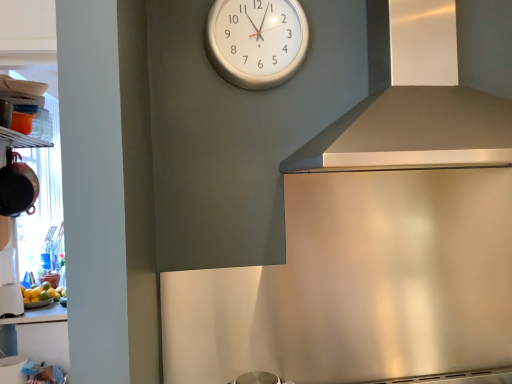
The height and width of the screenshot is (384, 512). I want to click on white glossy clock at upper center, so click(x=256, y=41).

You are a GUI agent. You are given a task and a screenshot of the screen. Output one action in this format:
    pyautogui.click(x=<x>, y=<y>)
    Task: Click on the yellow matte bowl at lower left
    The height and width of the screenshot is (384, 512).
    Given the screenshot: What is the action you would take?
    click(x=41, y=293)

Where is `satin silver exhaust hood at upper right`? satin silver exhaust hood at upper right is located at coordinates (429, 95).

Where is `white glossy cup at lower left, which ranks as the 2th appliance in top-to-bottom order`? This screenshot has height=384, width=512. white glossy cup at lower left, which ranks as the 2th appliance in top-to-bottom order is located at coordinates (11, 300).

Find the location of `white glossy clock at upper center`. white glossy clock at upper center is located at coordinates (256, 41).

Is white glossy cup at lower left, which is counted as the first appliance, starting from the bottom, inside or outside of yellow matte bowl at lower left?

white glossy cup at lower left, which is counted as the first appliance, starting from the bottom, is spatially situated outside yellow matte bowl at lower left.

Is yellow matte bowl at lower left at the back of white glossy cup at lower left, which is counted as the first appliance, starting from the bottom?

white glossy cup at lower left, which is counted as the first appliance, starting from the bottom, does not have its back to yellow matte bowl at lower left.

Is white glossy cup at lower left, which ranks as the 2th appliance in top-to-bottom order, behind yellow matte bowl at lower left?

No, white glossy cup at lower left, which ranks as the 2th appliance in top-to-bottom order, is closer to the camera.

Measure the distance between satin silver exhaust hood at upper right and white glossy cup at lower left, which is counted as the first appliance, starting from the bottom.

satin silver exhaust hood at upper right is 7.24 feet from white glossy cup at lower left, which is counted as the first appliance, starting from the bottom.

Does satin silver exhaust hood at upper right turn towards white glossy cup at lower left, which is counted as the first appliance, starting from the bottom?

No, satin silver exhaust hood at upper right is not turned towards white glossy cup at lower left, which is counted as the first appliance, starting from the bottom.

Find the location of a particular element. Image resolution: width=512 pixels, height=384 pixels. the 2nd appliance to the left when counting from the satin silver exhaust hood at upper right is located at coordinates (11, 300).

From the image's perspective, is satin silver exhaust hood at upper right beneath white glossy cup at lower left, which ranks as the 2th appliance in top-to-bottom order?

Actually, satin silver exhaust hood at upper right appears above white glossy cup at lower left, which ranks as the 2th appliance in top-to-bottom order, in the image.

From a real-world perspective, which object stands above the other?

white glossy cup at lower left, which is counted as the first appliance, starting from the bottom, is physically above.

Is yellow matte bowl at lower left behind white glossy cup at lower left, which ranks as the 2th appliance in top-to-bottom order?

Yes, the depth of yellow matte bowl at lower left is greater than that of white glossy cup at lower left, which ranks as the 2th appliance in top-to-bottom order.

Between yellow matte bowl at lower left and white glossy cup at lower left, which ranks as the 2th appliance in top-to-bottom order, which one appears on the left side from the viewer's perspective?

white glossy cup at lower left, which ranks as the 2th appliance in top-to-bottom order.

Which point is more forward, (36, 301) or (21, 302)?

Positioned in front is point (21, 302).

Which object is thinner, yellow matte bowl at lower left or matte black pot at left, the first appliance from the top?

With smaller width is matte black pot at left, the first appliance from the top.

Can you confirm if yellow matte bowl at lower left is smaller than matte black pot at left, the first appliance from the top?

Yes, yellow matte bowl at lower left is smaller than matte black pot at left, the first appliance from the top.

Looking at this image, is yellow matte bowl at lower left oriented away from matte black pot at left, the 2th appliance in the bottom-to-top sequence?

No.

Looking at this image, is yellow matte bowl at lower left beside matte black pot at left, the first appliance from the top?

No, yellow matte bowl at lower left is not with matte black pot at left, the first appliance from the top.

Does point (259, 28) come behind point (33, 297)?

That is False.

How different are the orientations of white glossy clock at upper center and yellow matte bowl at lower left in degrees?

The angle between the facing direction of white glossy clock at upper center and the facing direction of yellow matte bowl at lower left is 90.9 degrees.

Is white glossy clock at upper center next to yellow matte bowl at lower left?

No, white glossy clock at upper center is not beside yellow matte bowl at lower left.

Considering the sizes of objects white glossy clock at upper center and yellow matte bowl at lower left in the image provided, who is wider, white glossy clock at upper center or yellow matte bowl at lower left?

yellow matte bowl at lower left is wider.

From the image's perspective, is satin silver exhaust hood at upper right located beneath matte black pot at left, the 2th appliance in the bottom-to-top sequence?

Actually, satin silver exhaust hood at upper right appears above matte black pot at left, the 2th appliance in the bottom-to-top sequence, in the image.

Is satin silver exhaust hood at upper right oriented towards matte black pot at left, the 2th appliance in the bottom-to-top sequence?

No.

Between satin silver exhaust hood at upper right and matte black pot at left, the 2th appliance in the bottom-to-top sequence, which one appears on the left side from the viewer's perspective?

Positioned to the left is matte black pot at left, the 2th appliance in the bottom-to-top sequence.

Is satin silver exhaust hood at upper right positioned in front of matte black pot at left, the 2th appliance in the bottom-to-top sequence?

Yes.

From a real-world perspective, is white glossy cup at lower left, which is counted as the first appliance, starting from the bottom, physically above matte black pot at left, the 2th appliance in the bottom-to-top sequence?

No.

Is white glossy cup at lower left, which ranks as the 2th appliance in top-to-bottom order, facing towards matte black pot at left, the first appliance from the top?

No, white glossy cup at lower left, which ranks as the 2th appliance in top-to-bottom order, is not oriented towards matte black pot at left, the first appliance from the top.

Does white glossy cup at lower left, which ranks as the 2th appliance in top-to-bottom order, have a greater height compared to matte black pot at left, the 2th appliance in the bottom-to-top sequence?

No, white glossy cup at lower left, which ranks as the 2th appliance in top-to-bottom order, is not taller than matte black pot at left, the 2th appliance in the bottom-to-top sequence.

Which object is more forward, white glossy cup at lower left, which ranks as the 2th appliance in top-to-bottom order, or matte black pot at left, the 2th appliance in the bottom-to-top sequence?

matte black pot at left, the 2th appliance in the bottom-to-top sequence, is closer to the camera.

You are a GUI agent. You are given a task and a screenshot of the screen. Output one action in this format:
    pyautogui.click(x=<x>, y=<y>)
    Task: Click on the 2nd appliance to the left when counting from the yellow matte bowl at lower left
    
    Given the screenshot: What is the action you would take?
    pyautogui.click(x=11, y=300)

From the image's perspective, count 2nd appliances downward from the satin silver exhaust hood at upper right and point to it. Please provide its 2D coordinates.

[(11, 300)]

Which object lies further to the anchor point white glossy cup at lower left, which is counted as the first appliance, starting from the bottom, white glossy clock at upper center or satin silver exhaust hood at upper right?

satin silver exhaust hood at upper right lies further to white glossy cup at lower left, which is counted as the first appliance, starting from the bottom, than the other object.

From the image, which object appears to be farther from white glossy clock at upper center, yellow matte bowl at lower left or satin silver exhaust hood at upper right?

yellow matte bowl at lower left is positioned further to the anchor white glossy clock at upper center.

Which object lies nearer to the anchor point white glossy clock at upper center, white glossy cup at lower left, which ranks as the 2th appliance in top-to-bottom order, or matte black pot at left, the first appliance from the top?

matte black pot at left, the first appliance from the top.

When comparing their distances from white glossy clock at upper center, does yellow matte bowl at lower left or white glossy cup at lower left, which ranks as the 2th appliance in top-to-bottom order, seem closer?

white glossy cup at lower left, which ranks as the 2th appliance in top-to-bottom order, is closer to white glossy clock at upper center.

Which object lies nearer to the anchor point satin silver exhaust hood at upper right, white glossy cup at lower left, which is counted as the first appliance, starting from the bottom, or matte black pot at left, the 2th appliance in the bottom-to-top sequence?

matte black pot at left, the 2th appliance in the bottom-to-top sequence, is closer to satin silver exhaust hood at upper right.

Which object lies nearer to the anchor point matte black pot at left, the first appliance from the top, satin silver exhaust hood at upper right or white glossy clock at upper center?

white glossy clock at upper center.

Looking at the image, which one is located closer to white glossy cup at lower left, which ranks as the 2th appliance in top-to-bottom order, matte black pot at left, the first appliance from the top, or yellow matte bowl at lower left?

The object closer to white glossy cup at lower left, which ranks as the 2th appliance in top-to-bottom order, is yellow matte bowl at lower left.

Considering their positions, is satin silver exhaust hood at upper right positioned closer to matte black pot at left, the first appliance from the top, than white glossy cup at lower left, which ranks as the 2th appliance in top-to-bottom order?

white glossy cup at lower left, which ranks as the 2th appliance in top-to-bottom order, is positioned closer to the anchor matte black pot at left, the first appliance from the top.

Locate an element on the screen. Image resolution: width=512 pixels, height=384 pixels. food between matte black pot at left, the first appliance from the top, and satin silver exhaust hood at upper right is located at coordinates (41, 293).

Locate an element on the screen. The image size is (512, 384). appliance situated between white glossy cup at lower left, which is counted as the first appliance, starting from the bottom, and satin silver exhaust hood at upper right from left to right is located at coordinates (17, 187).

Locate an element on the screen. wall clock between matte black pot at left, the first appliance from the top, and satin silver exhaust hood at upper right, in the horizontal direction is located at coordinates (256, 41).

At what (x,y) coordinates should I click in order to perform the action: click on appliance between white glossy cup at lower left, which is counted as the first appliance, starting from the bottom, and white glossy clock at upper center. Please return your answer as a coordinate pair (x, y). This screenshot has width=512, height=384. Looking at the image, I should click on (17, 187).